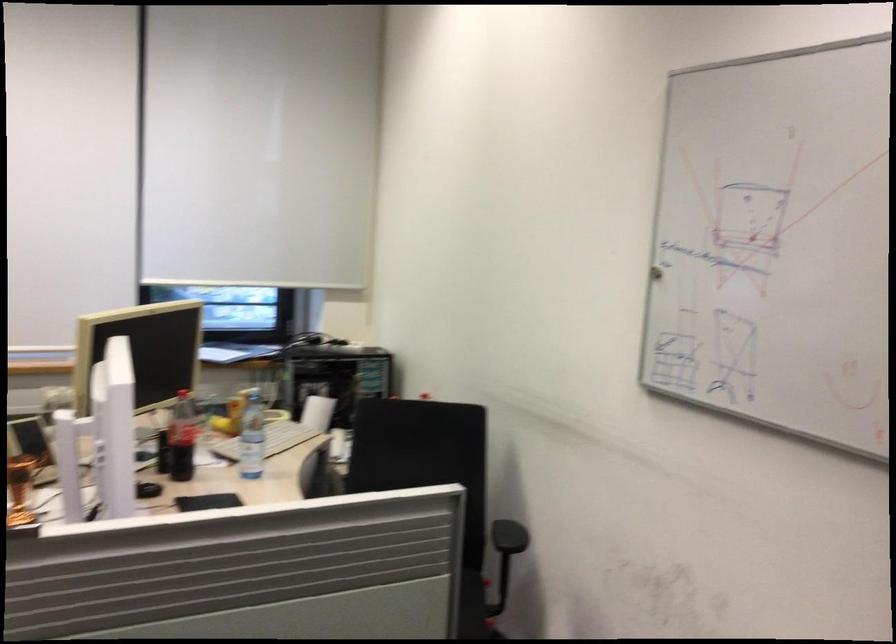
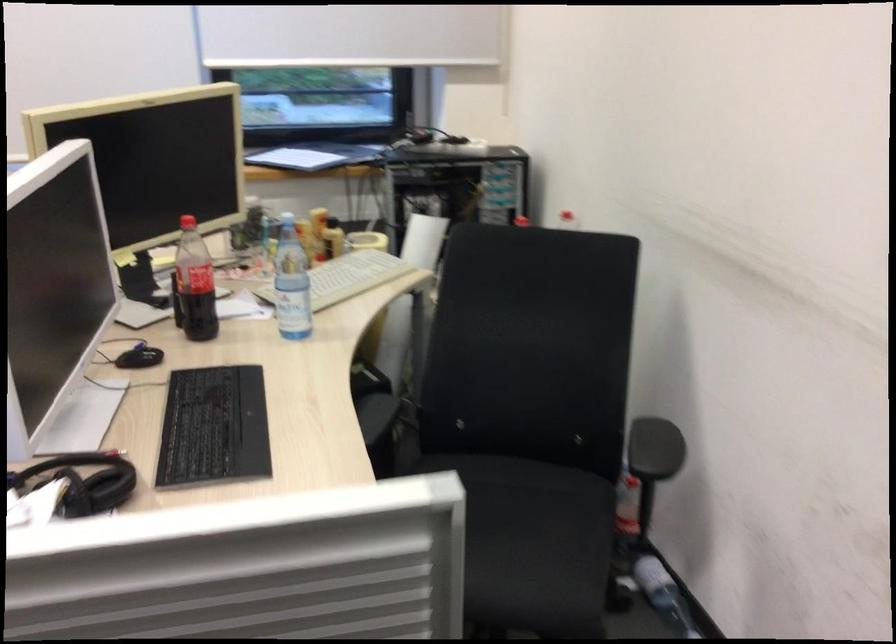
Where in the second image is the point corresponding to [174,435] from the first image?

(194, 283)